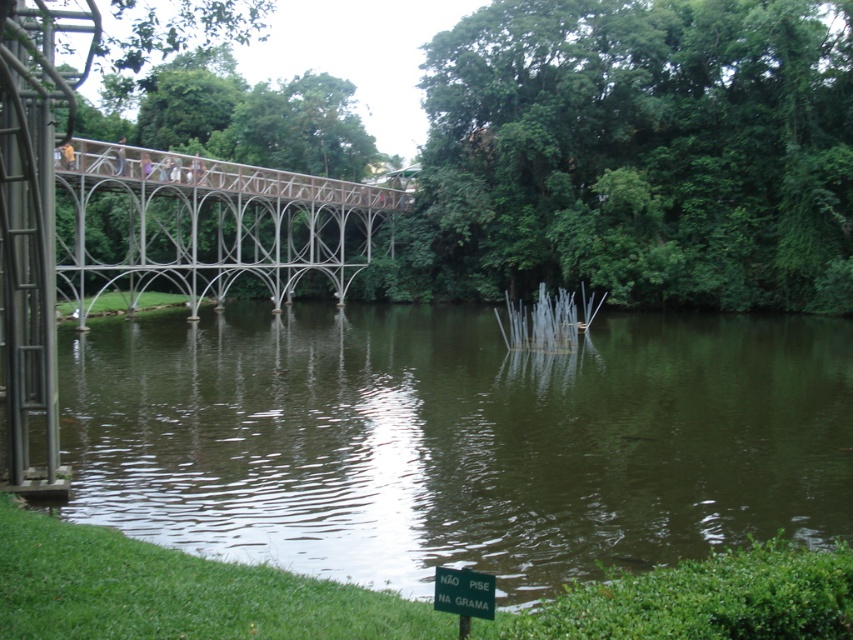
Is green reflective water at center further to camera compared to metallic bridge at upper center?

That is False.

Is green reflective water at center positioned in front of metallic bridge at upper center?

Yes, green reflective water at center is closer to the viewer.

Describe the element at coordinates (457, 440) in the screenshot. Image resolution: width=853 pixels, height=640 pixels. I see `green reflective water at center` at that location.

Where is `green reflective water at center`? green reflective water at center is located at coordinates (457, 440).

Can you confirm if metallic bridge at upper center is thinner than green plastic sign at lower center?

No.

Is metallic bridge at upper center in front of green plastic sign at lower center?

That is False.

Who is more distant from viewer, (202, 243) or (473, 589)?

Positioned behind is point (202, 243).

The image size is (853, 640). I want to click on metallic bridge at upper center, so click(204, 224).

Does green reflective water at center have a greater height compared to green plastic sign at lower center?

Yes.

Is green reflective water at center behind green plastic sign at lower center?

Yes, it is.

Is point (585, 400) positioned in front of point (480, 593)?

No, (585, 400) is further to viewer.

You are a GUI agent. You are given a task and a screenshot of the screen. Output one action in this format:
    pyautogui.click(x=<x>, y=<y>)
    Task: Click on the green reflective water at center
    
    Given the screenshot: What is the action you would take?
    pyautogui.click(x=457, y=440)